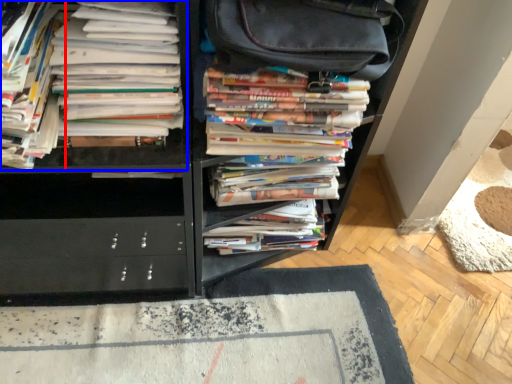
Question: Which point is further to the camera, book (highlighted by a red box) or book (highlighted by a blue box)?

Choices:
 (A) book
 (B) book

Answer: (B)